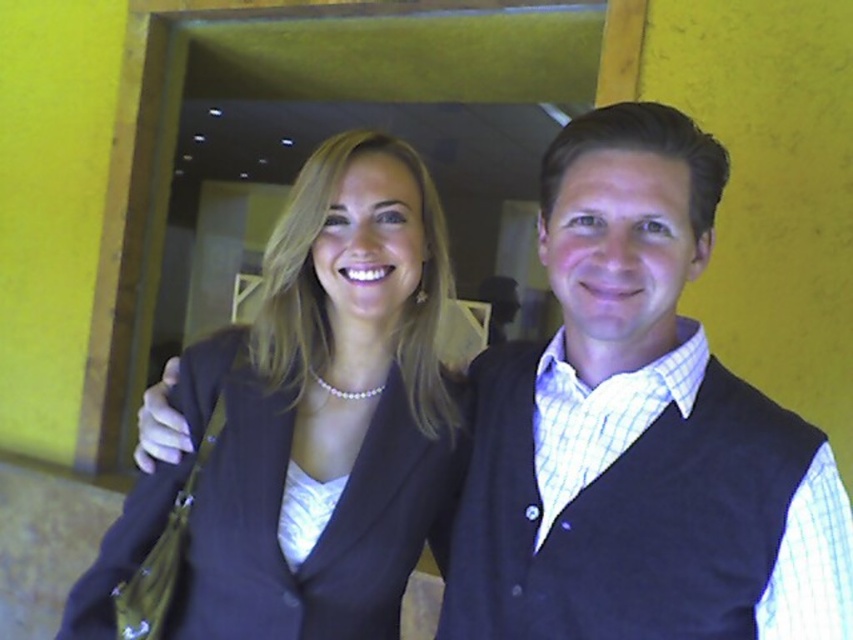
Which is in front, point (291, 253) or point (682, 538)?

Point (682, 538)

Describe the element at coordinates (326, 408) in the screenshot. Image resolution: width=853 pixels, height=640 pixels. I see `matte black blazer at center` at that location.

This screenshot has width=853, height=640. I want to click on matte black blazer at center, so click(x=326, y=408).

At what (x,y) coordinates should I click in order to perform the action: click on matte black blazer at center. Please return your answer as a coordinate pair (x, y). Looking at the image, I should click on (326, 408).

Between dark blue wool vest at right and white satin dress at center, which one is positioned lower?

white satin dress at center

Can you confirm if dark blue wool vest at right is smaller than white satin dress at center?

Actually, dark blue wool vest at right might be larger than white satin dress at center.

Does point (482, 540) lie behind point (303, 528)?

That is True.

At what (x,y) coordinates should I click in order to perform the action: click on dark blue wool vest at right. Please return your answer as a coordinate pair (x, y). This screenshot has height=640, width=853. Looking at the image, I should click on (642, 506).

Does matte black blazer at center have a lesser width compared to white satin dress at center?

No, matte black blazer at center is not thinner than white satin dress at center.

Between matte black blazer at center and white satin dress at center, which one appears on the left side from the viewer's perspective?

From the viewer's perspective, white satin dress at center appears more on the left side.

Where is `matte black blazer at center`? matte black blazer at center is located at coordinates (326, 408).